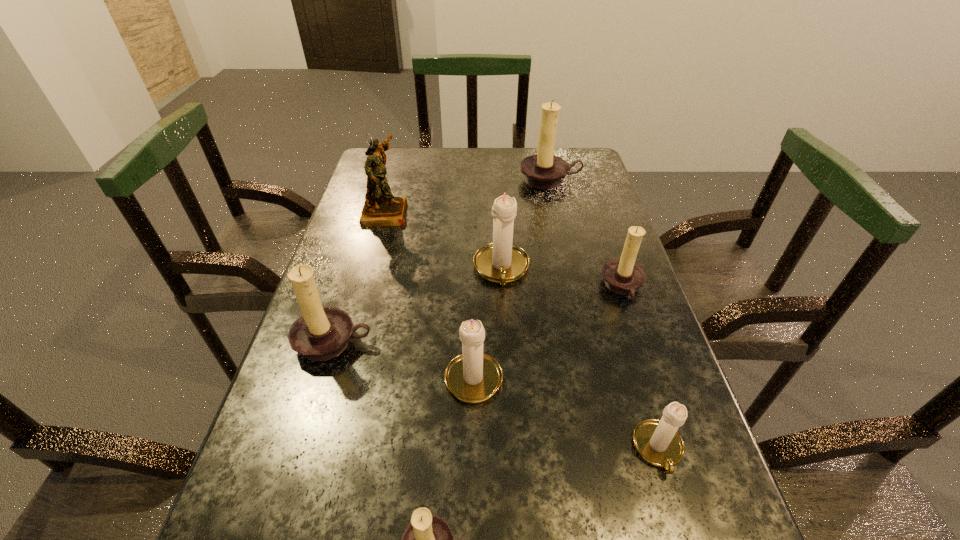
Where is `free area in between the rightmost white candle holder and the tallest candle holder`? The image size is (960, 540). free area in between the rightmost white candle holder and the tallest candle holder is located at coordinates (604, 315).

Where is `vacant area that lies between the leftmost candle holder and the farthest white candle holder`? The image size is (960, 540). vacant area that lies between the leftmost candle holder and the farthest white candle holder is located at coordinates (418, 306).

Identify the location of vacant point located between the second smallest white candle holder and the biggest white candle holder. (488, 322).

In order to click on the fifth closest object to the farthest brown candle holder in this screenshot , I will do `click(321, 333)`.

Where is `object that stands as the sixth closest to the tallest candle holder`? This screenshot has width=960, height=540. object that stands as the sixth closest to the tallest candle holder is located at coordinates (658, 442).

This screenshot has height=540, width=960. Find the location of `candle holder that stands as the sixth closest to the third brown candle holder from right to left`. candle holder that stands as the sixth closest to the third brown candle holder from right to left is located at coordinates (542, 171).

Select which candle holder appears as the second closest to the farthest white candle holder. Please provide its 2D coordinates. Your answer should be formatted as a tuple, i.e. [(x, y)], where the tuple contains the x and y coordinates of a point satisfying the conditions above.

[(623, 276)]

Image resolution: width=960 pixels, height=540 pixels. What are the coordinates of `brown candle holder that is the third closest to the third farthest brown candle holder` in the screenshot? It's located at (542, 171).

I want to click on the second closest brown candle holder to the biggest white candle holder, so click(x=321, y=333).

Select which white candle holder is the second closest to the second smallest white candle holder. Please provide its 2D coordinates. Your answer should be formatted as a tuple, i.e. [(x, y)], where the tuple contains the x and y coordinates of a point satisfying the conditions above.

[(658, 442)]